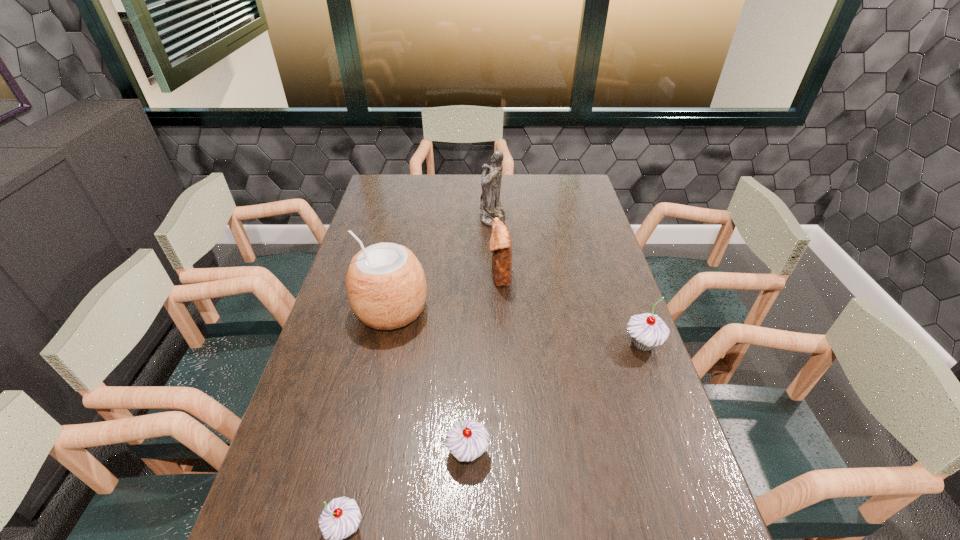
This screenshot has width=960, height=540. What are the coordinates of `the second nearest object` in the screenshot? It's located at (467, 440).

Locate an element on the screen. Image resolution: width=960 pixels, height=540 pixels. the second shortest object is located at coordinates (467, 440).

Find the location of a particular element. This screenshot has width=960, height=540. the rightmost object is located at coordinates (647, 330).

Where is `the rightmost cupcake`? the rightmost cupcake is located at coordinates (647, 330).

Where is `clutch bag`? The image size is (960, 540). clutch bag is located at coordinates (500, 244).

Image resolution: width=960 pixels, height=540 pixels. Find the location of `figurine`. figurine is located at coordinates (491, 207).

The height and width of the screenshot is (540, 960). I want to click on coconut, so click(386, 285).

Locate an element on the screen. blank space located 0.090m on the back of the fifth tallest object is located at coordinates (468, 400).

Where is `vacant area situated on the front of the rightmost cupcake`? vacant area situated on the front of the rightmost cupcake is located at coordinates (686, 465).

Identify the location of blank area located 0.360m on the open side of the clutch bag. The width and height of the screenshot is (960, 540). (382, 275).